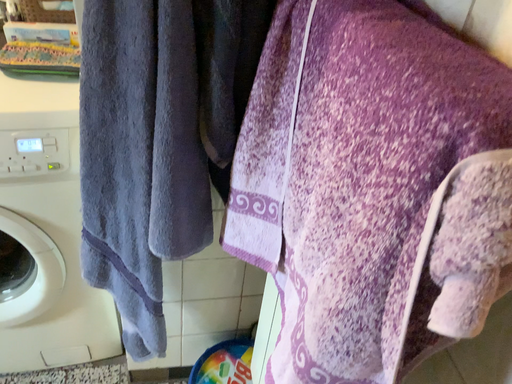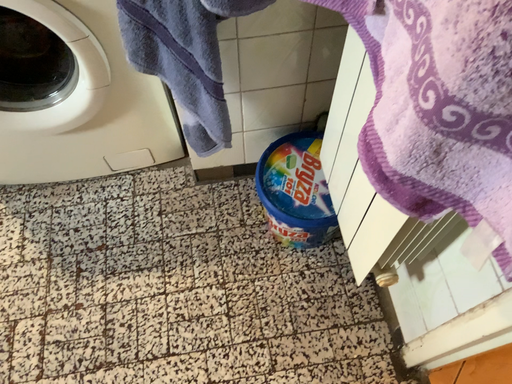
Question: How did the camera likely rotate when shooting the video?

Choices:
 (A) rotated upward
 (B) rotated downward

Answer: (B)